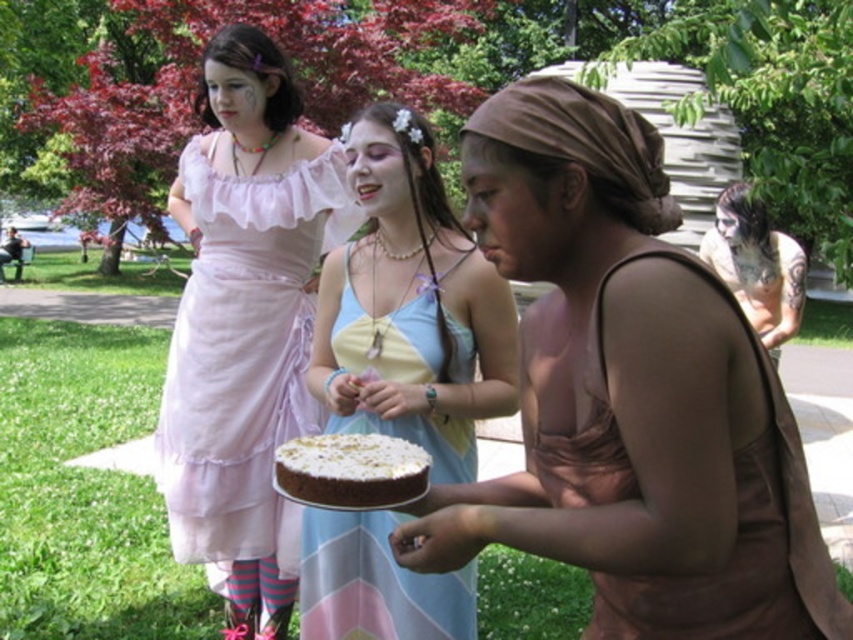
Which is below, brown matte dress at center or white frosted chocolate cake at center?

white frosted chocolate cake at center is below.

How far apart are brown matte dress at center and white frosted chocolate cake at center?

They are 33.44 centimeters apart.

Between point (730, 444) and point (347, 451), which one is positioned behind?

The point (347, 451) is behind.

Locate an element on the screen. brown matte dress at center is located at coordinates (630, 394).

Which of these two, brown matte dress at center or light blue satin dress at center, stands shorter?

brown matte dress at center

Does point (669, 600) come behind point (457, 608)?

No, (669, 600) is in front of (457, 608).

Between point (633, 259) and point (433, 628), which one is positioned in front?

Point (633, 259)

Find the location of a particular element. This screenshot has width=853, height=640. brown matte dress at center is located at coordinates (630, 394).

Does pastel pink chiffon dress at upper left lie in front of light blue satin dress at center?

No.

Describe the element at coordinates (244, 353) in the screenshot. I see `pastel pink chiffon dress at upper left` at that location.

The height and width of the screenshot is (640, 853). What do you see at coordinates (244, 353) in the screenshot?
I see `pastel pink chiffon dress at upper left` at bounding box center [244, 353].

The height and width of the screenshot is (640, 853). I want to click on pastel pink chiffon dress at upper left, so click(244, 353).